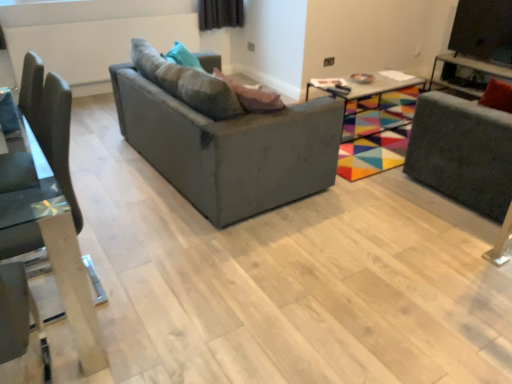
This screenshot has width=512, height=384. In order to click on vacant space to the right of transparent glass chair at left in this screenshot , I will do `click(194, 284)`.